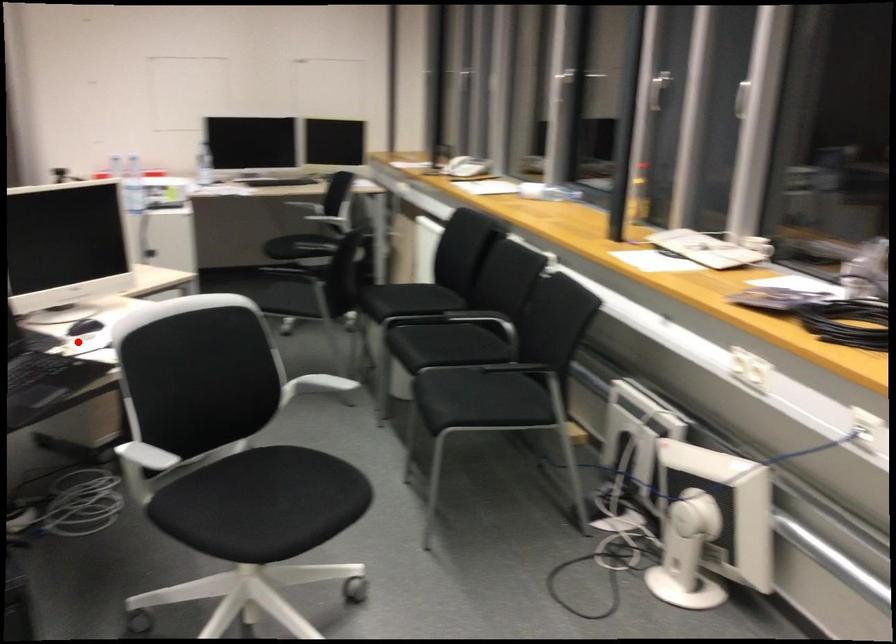
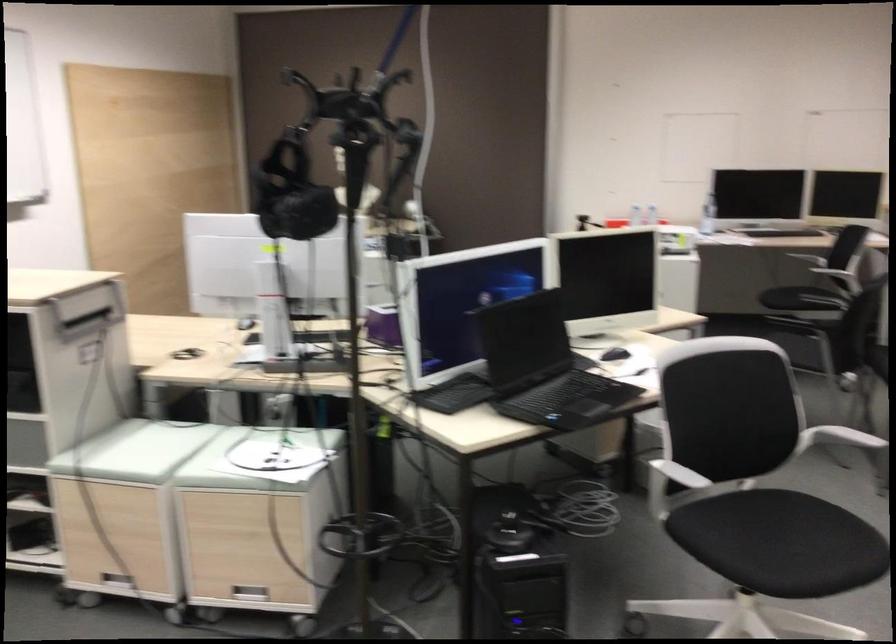
In the second image, find the point that corresponds to the highlighted location in the first image.

(615, 354)